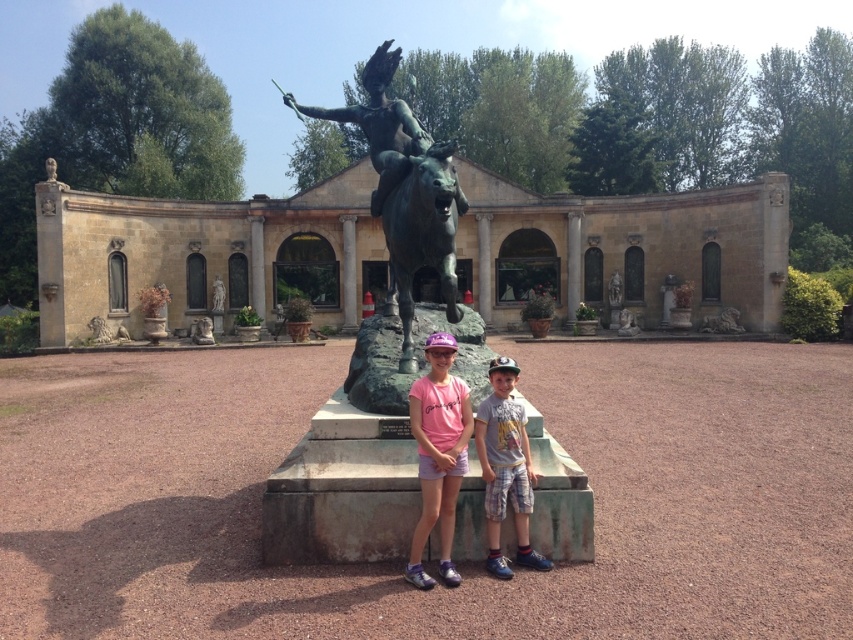
From the picture: You are a photographer planning to take a group photo of your friends in front of the large ornate building. You want to ensure that both the bronze statue at center and the gray cotton shirt at center are clearly visible in the photo. Given their sizes, which object should you position closer to the camera to ensure both are visible without one overpowering the other?

Since the bronze statue at center is larger than the gray cotton shirt at center, you should position the gray cotton shirt at center closer to the camera. This way, the smaller gray cotton shirt at center will appear larger in the photo, balancing its visibility with the larger bronze statue at center.

You are a tourist visiting this historical site and want to take a photo of the bronze statue at center without the stone building at center blocking the view. Is this possible given their positions?

The bronze statue at center is behind the stone building at center, so it would be blocked by the building and not visible in the photo unless you move to a position where the statue is not obscured by the building.